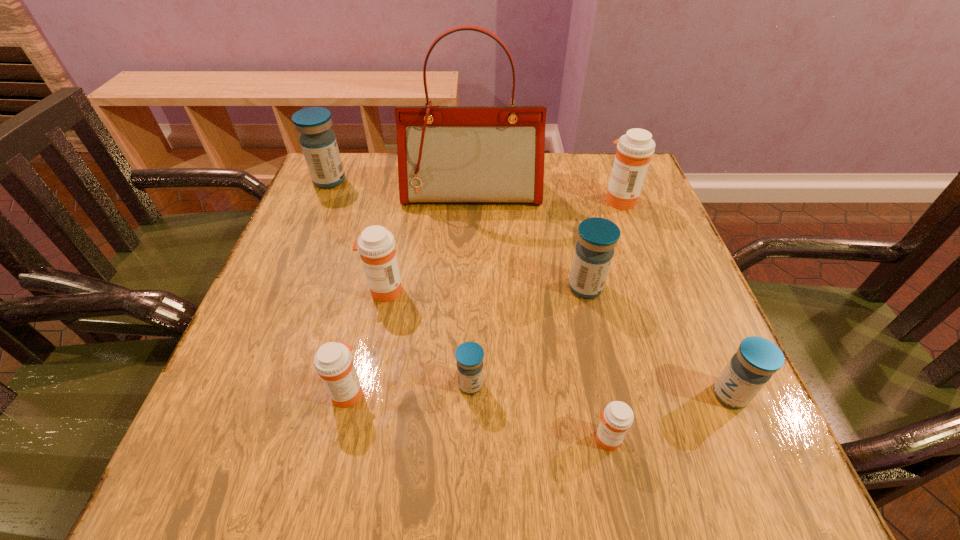
I want to click on vacant position located on the back of the third biggest orange medicine, so click(x=374, y=275).

Find the location of `free space located on the back of the rightmost blue medicine`. free space located on the back of the rightmost blue medicine is located at coordinates (670, 257).

I want to click on vacant space situated 0.340m on the left of the nearest medicine, so click(x=369, y=439).

I want to click on vacant position located 0.080m on the back of the fourth medicine from left to right, so click(471, 335).

Find the location of a particular element. handbag that is at the far edge is located at coordinates (446, 154).

Locate an element on the screen. Image resolution: width=960 pixels, height=540 pixels. object at the near edge is located at coordinates (617, 418).

This screenshot has width=960, height=540. I want to click on object that is at the left edge, so click(x=318, y=142).

Identify the location of object present at the far left corner. (318, 142).

Where is `object at the far right corner`? Image resolution: width=960 pixels, height=540 pixels. object at the far right corner is located at coordinates (634, 150).

Where is `vacant space at the far edge of the desktop`? This screenshot has height=540, width=960. vacant space at the far edge of the desktop is located at coordinates (391, 154).